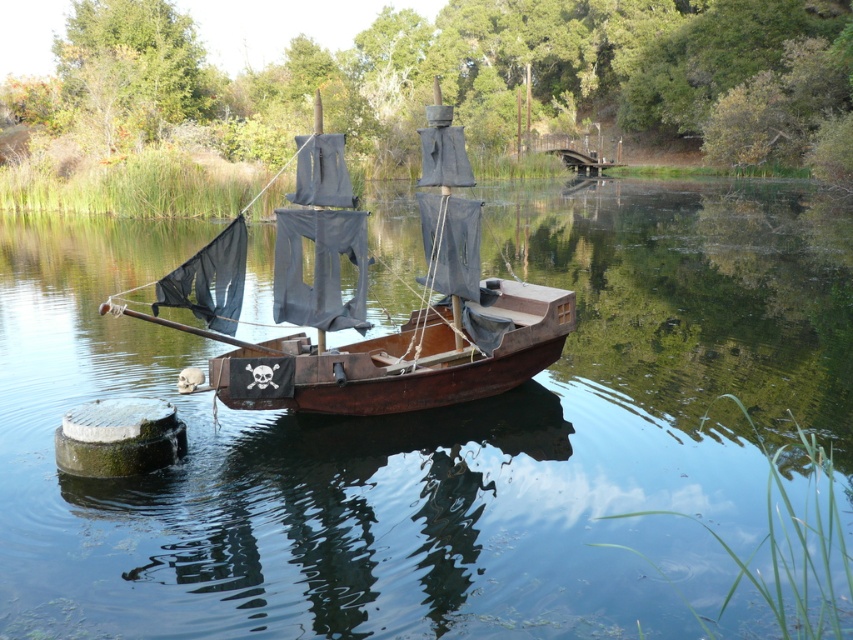
What are the coordinates of `transparent water at center` in the screenshot? It's located at (436, 435).

Does transparent water at center appear under rusty wood sailboat at center?

Incorrect, transparent water at center is not positioned below rusty wood sailboat at center.

Where is `transparent water at center`? The width and height of the screenshot is (853, 640). transparent water at center is located at coordinates (436, 435).